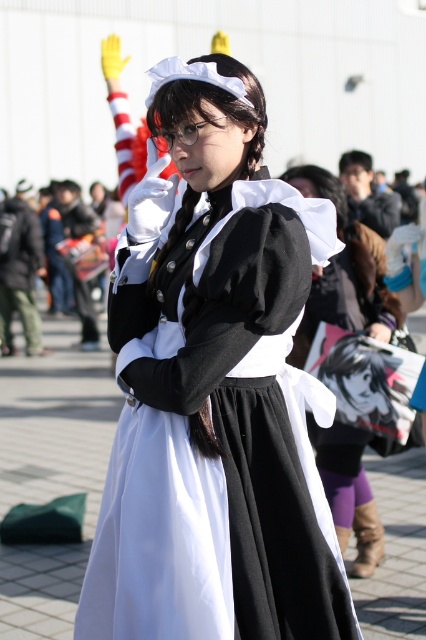
Find the location of a particular element. The height and width of the screenshot is (640, 426). matte black dress at center is located at coordinates (215, 388).

What do you see at coordinates (215, 388) in the screenshot? This screenshot has height=640, width=426. I see `matte black dress at center` at bounding box center [215, 388].

The width and height of the screenshot is (426, 640). What do you see at coordinates (215, 388) in the screenshot? I see `matte black dress at center` at bounding box center [215, 388].

The width and height of the screenshot is (426, 640). I want to click on matte black dress at center, so click(215, 388).